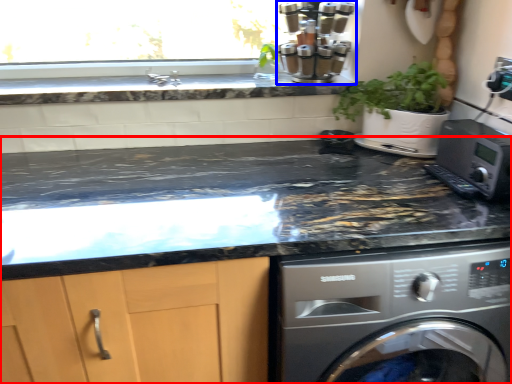
Question: Among these objects, which one is nearest to the camera, countertop (highlighted by a red box) or coffee machine (highlighted by a blue box)?

Choices:
 (A) countertop
 (B) coffee machine

Answer: (A)